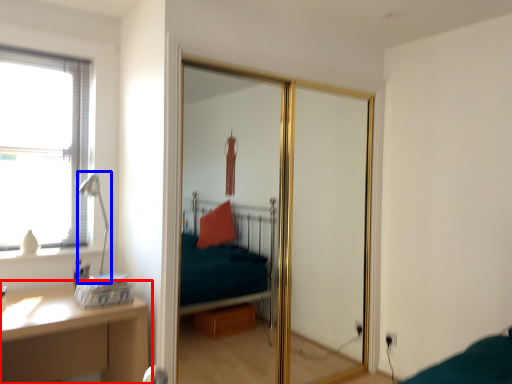
Question: Which of the following is the farthest to the observer, table (highlighted by a red box) or table lamp (highlighted by a blue box)?

Choices:
 (A) table
 (B) table lamp

Answer: (B)